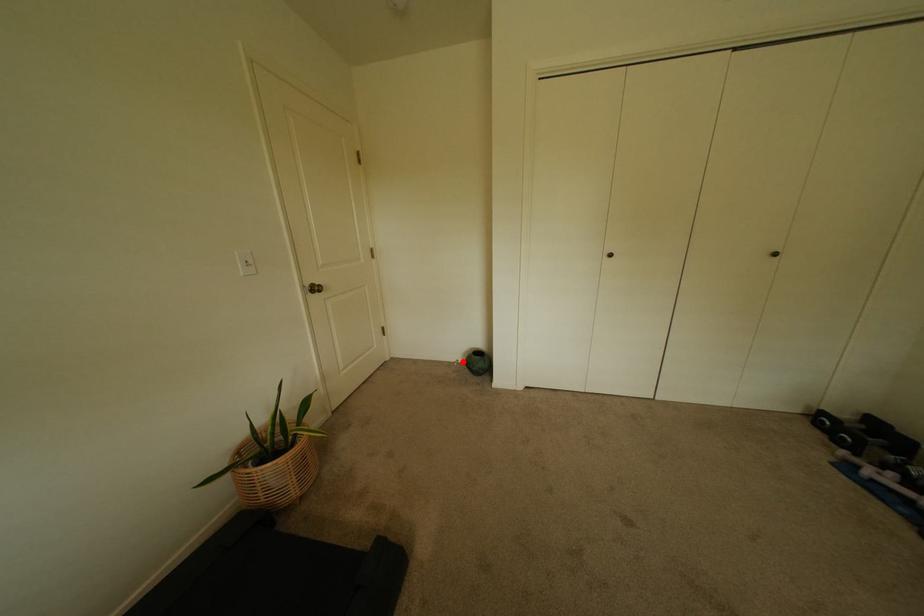
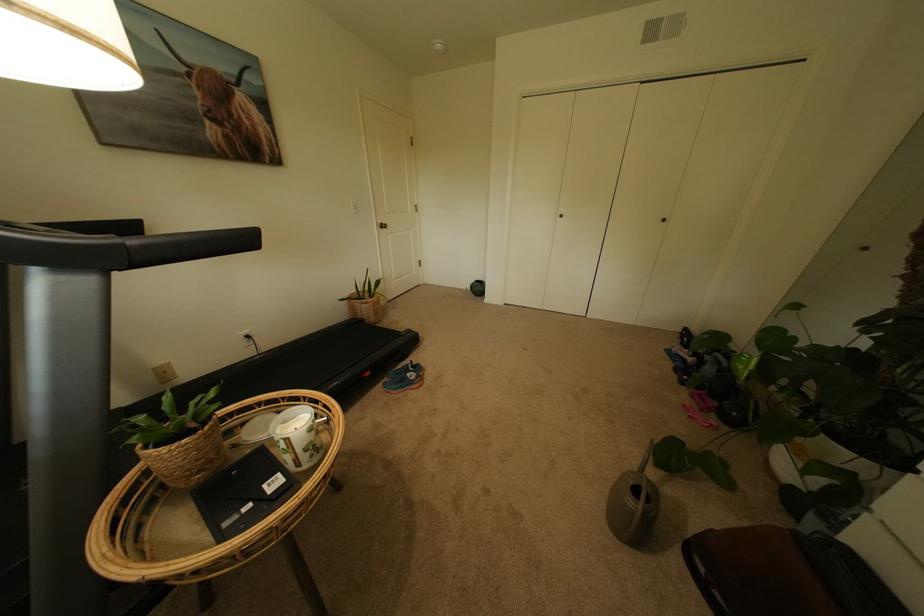
Where in the second image is the point corresponding to the highlighted location from the first image?

(473, 289)